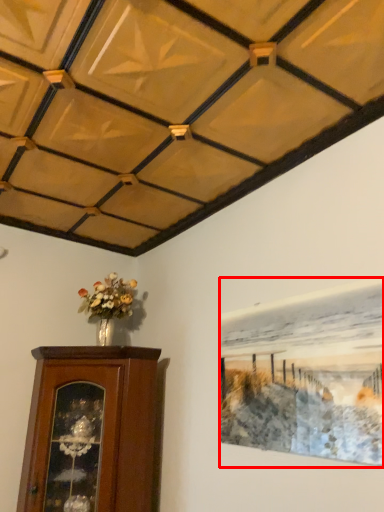
Question: From the image's perspective, where is picture frame (annotated by the red box) located relative to furniture?

Choices:
 (A) above
 (B) below

Answer: (A)